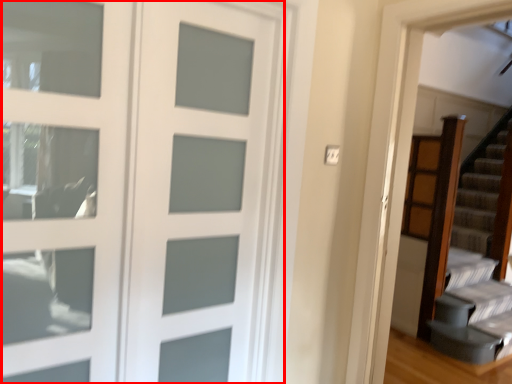
Question: In this image, where is door (annotated by the red box) located relative to screen door?

Choices:
 (A) right
 (B) left

Answer: (A)